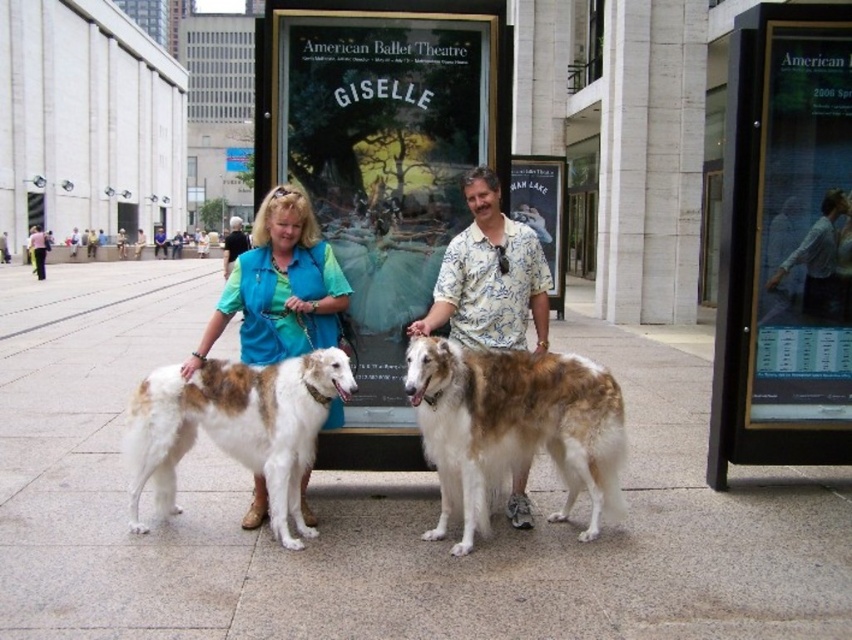
Question: Does brown and white fur at center have a greater width compared to floral shirt at center?

Choices:
 (A) yes
 (B) no

Answer: (A)

Question: Which object is closer to the camera taking this photo?

Choices:
 (A) blue fabric vest at center
 (B) white marble pavement at center
 (C) fluffy brown dog at center
 (D) floral shirt at center

Answer: (B)

Question: Can you confirm if brown and white fur at center is positioned below blue fabric vest at center?

Choices:
 (A) no
 (B) yes

Answer: (B)

Question: Among these points, which one is nearest to the camera?

Choices:
 (A) (160, 406)
 (B) (471, 435)
 (C) (188, 573)

Answer: (C)

Question: Can you confirm if blue fabric vest at center is positioned to the right of floral shirt at center?

Choices:
 (A) no
 (B) yes

Answer: (A)

Question: Based on their relative distances, which object is farther from the floral shirt at center?

Choices:
 (A) fluffy brown dog at center
 (B) brown and white fur at center
 (C) white marble pavement at center
 (D) metallic silver sign at right

Answer: (C)